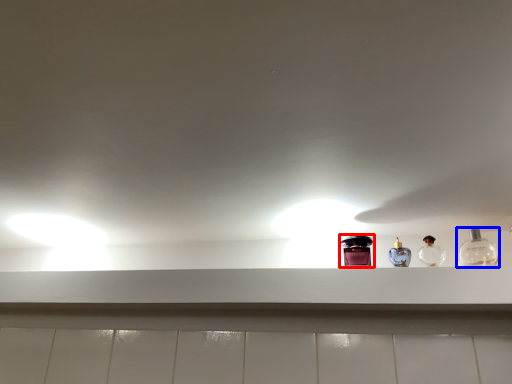
Question: Which of the following is the farthest to the observer, bottle (highlighted by a red box) or bottle (highlighted by a blue box)?

Choices:
 (A) bottle
 (B) bottle

Answer: (A)